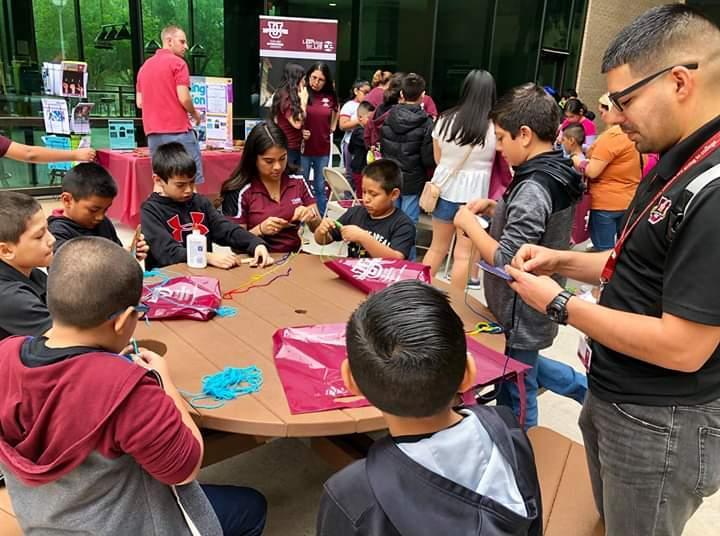
The width and height of the screenshot is (720, 536). Identify the location of floor. (299, 482), (564, 348).